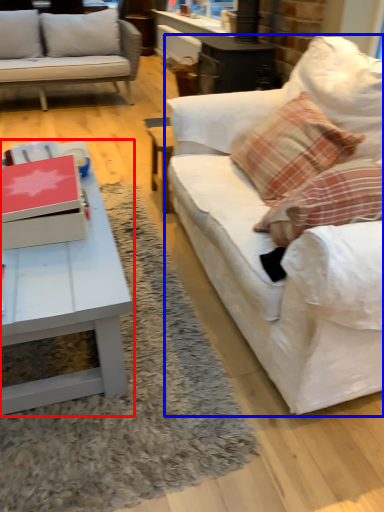
Question: Which object is further to the camera taking this photo, coffee table (highlighted by a red box) or studio couch (highlighted by a blue box)?

Choices:
 (A) coffee table
 (B) studio couch

Answer: (A)